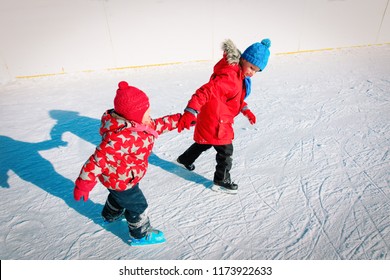
Where is `yellow in corner of wall`? yellow in corner of wall is located at coordinates (45, 75), (162, 64), (303, 50), (376, 45).